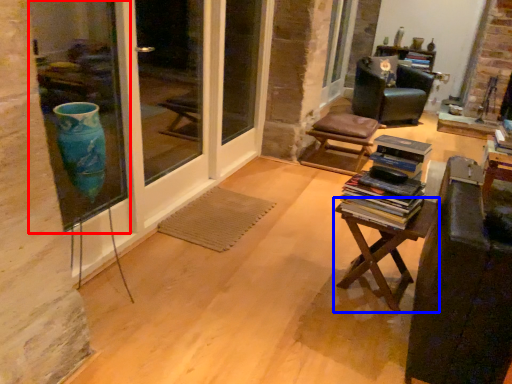
Question: Among these objects, which one is nearest to the camera, window (highlighted by a red box) or table (highlighted by a blue box)?

Choices:
 (A) window
 (B) table

Answer: (A)